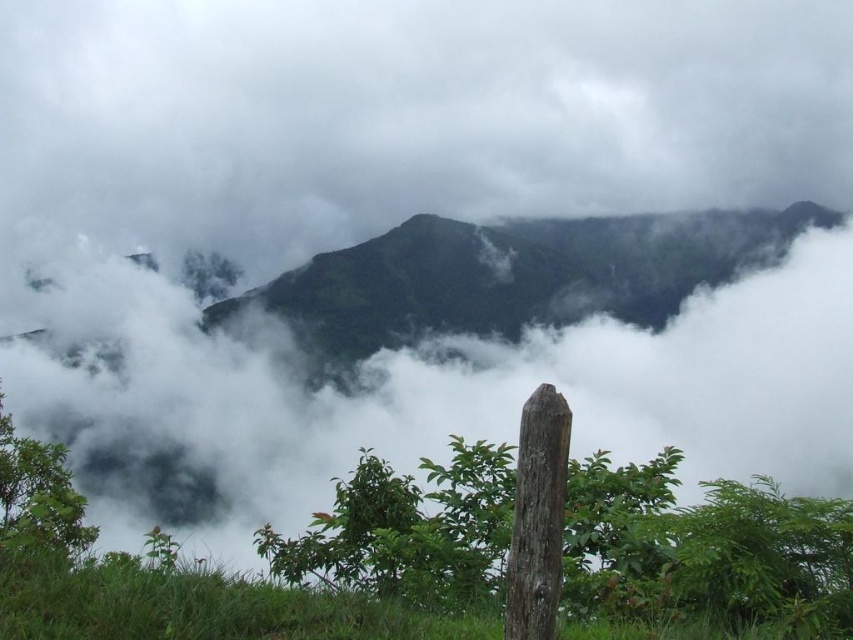
Can you confirm if green matte mountain at center is smaller than brown rough wood pole at center?

Incorrect, green matte mountain at center is not smaller in size than brown rough wood pole at center.

Find the location of a particular element. green matte mountain at center is located at coordinates (514, 275).

Find the location of `green matte mountain at center`. green matte mountain at center is located at coordinates (514, 275).